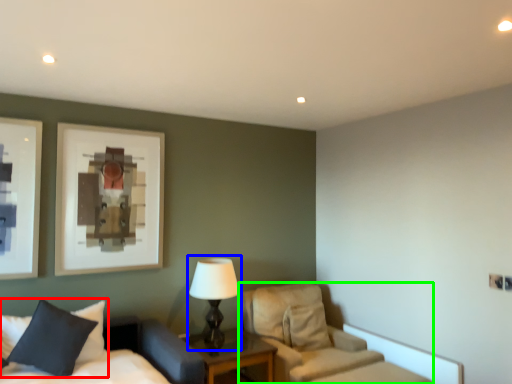
Question: Which object is positioned closest to pillow (highlighted by a red box)? Select from table lamp (highlighted by a blue box) and chair (highlighted by a green box).

Choices:
 (A) table lamp
 (B) chair

Answer: (A)